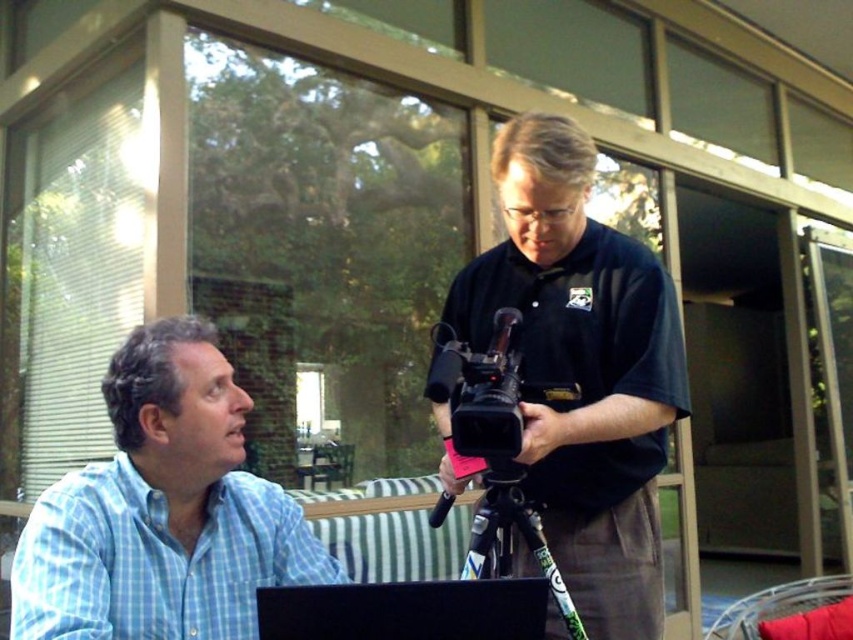
You are standing in front of the two points, point (x=114, y=621) and point (x=514, y=508). Which point is nearer to you?

Point (x=114, y=621) is closer to the viewer than point (x=514, y=508).

You are setting up equipment for a video call. You have a black matte camera at center and a black matte laptop at lower center. Which one should you place closer to the edge of the table to ensure both fit comfortably?

The black matte laptop at lower center should be placed closer to the edge since it is smaller than the black matte camera at center, allowing both to fit comfortably on the table.

Consider the image. You are a photographer who needs to place a small tripod in the scene. The tripod must be placed between the black matte camera at center and the blue checkered shirt at left. Given that the camera is larger than the shirt, where should you position the tripod to ensure it is closer to the smaller object?

The black matte camera at center is larger than the blue checkered shirt at left, so the tripod should be placed closer to the blue checkered shirt at left since it is the smaller object.